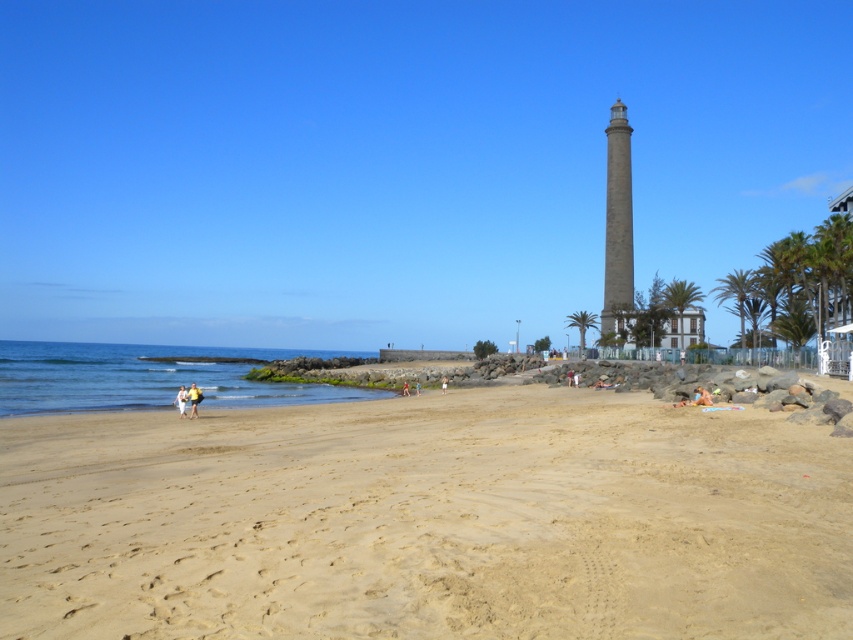
You are standing at the point marked by the coordinates point (x=426, y=520). What is the color of the sand beneath your feet?

The sand beneath your feet at point (x=426, y=520) is light brown sand at lower center.